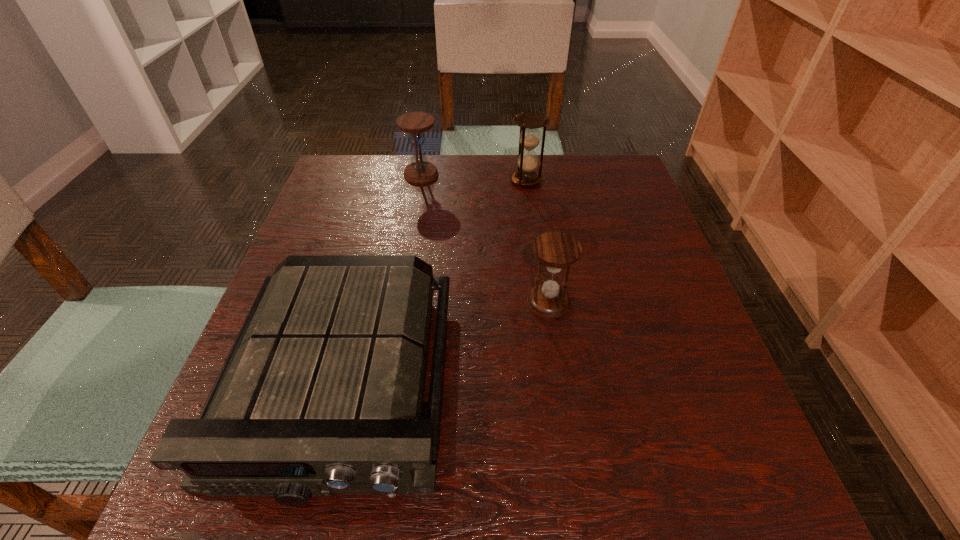
What are the coordinates of `free space at the right edge of the desktop` in the screenshot? It's located at click(x=630, y=206).

At what (x,y) coordinates should I click in order to perform the action: click on vacant position at the far left corner of the desktop. Please return your answer as a coordinate pair (x, y). The height and width of the screenshot is (540, 960). Looking at the image, I should click on (366, 185).

Identify the location of object that can be found as the third closest to the radio receiver. (420, 171).

Where is `object that is the closest to the nearest hourglass`? The width and height of the screenshot is (960, 540). object that is the closest to the nearest hourglass is located at coordinates (321, 393).

Identify the location of the second closest hourglass to the leftmost hourglass. The image size is (960, 540). (556, 250).

Point out which hourglass is positioned as the nearest to the nearest hourglass. Please provide its 2D coordinates. Your answer should be formatted as a tuple, i.e. [(x, y)], where the tuple contains the x and y coordinates of a point satisfying the conditions above.

[(525, 175)]

Locate an element on the screen. vacant position in the image that satisfies the following two spatial constraints: 1. on the front side of the nearest hourglass; 2. on the left side of the leftmost hourglass is located at coordinates (398, 303).